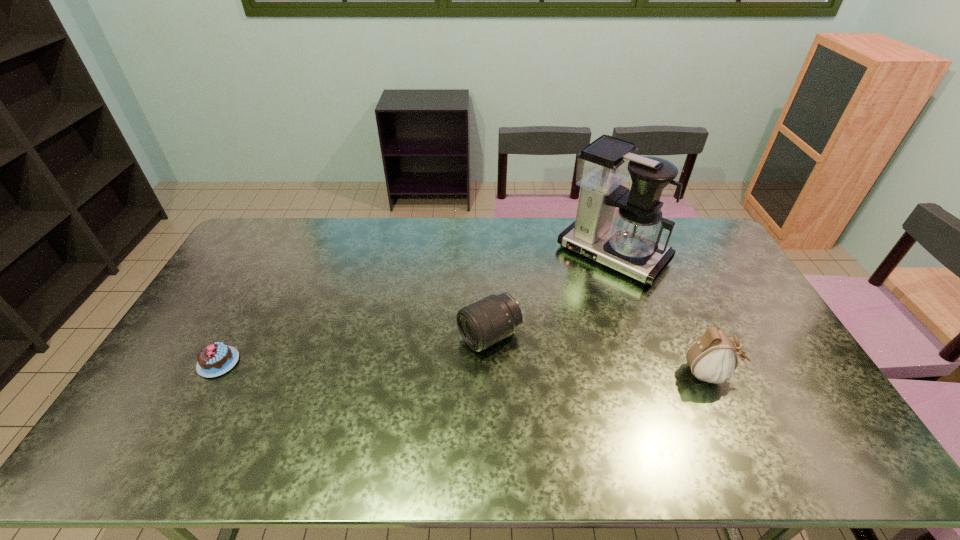
In the image, there is a desktop. Where is `vacant space at the right edge`? Image resolution: width=960 pixels, height=540 pixels. vacant space at the right edge is located at coordinates (753, 338).

This screenshot has width=960, height=540. Find the location of `vacant space at the far left corner of the desktop`. vacant space at the far left corner of the desktop is located at coordinates (236, 256).

In the image, there is a desktop. Where is `free space at the near left corner`? The image size is (960, 540). free space at the near left corner is located at coordinates (172, 398).

Identify the location of empty space that is in between the leftmost object and the second shortest object. The image size is (960, 540). (354, 349).

This screenshot has height=540, width=960. What are the coordinates of `vacant space in between the chocolate cake and the pouch` in the screenshot? It's located at (464, 368).

Where is `free space between the chocolate cake and the second tallest object`? The height and width of the screenshot is (540, 960). free space between the chocolate cake and the second tallest object is located at coordinates (464, 368).

Where is `free spot between the telephoto lens and the leftmost object`? This screenshot has width=960, height=540. free spot between the telephoto lens and the leftmost object is located at coordinates (354, 349).

This screenshot has height=540, width=960. In order to click on free spot between the chocolate cake and the coffee maker in this screenshot , I will do `click(416, 308)`.

Identify the location of vacant space that is in between the leftmost object and the pouch. The height and width of the screenshot is (540, 960). pyautogui.click(x=464, y=368).

Find the location of a particular element. vacant space in between the chocolate cake and the second shortest object is located at coordinates (354, 349).